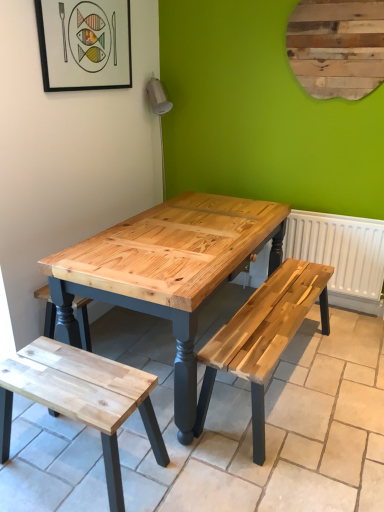
Image resolution: width=384 pixels, height=512 pixels. I want to click on free point to the right of natural wood bench at lower left, so click(201, 458).